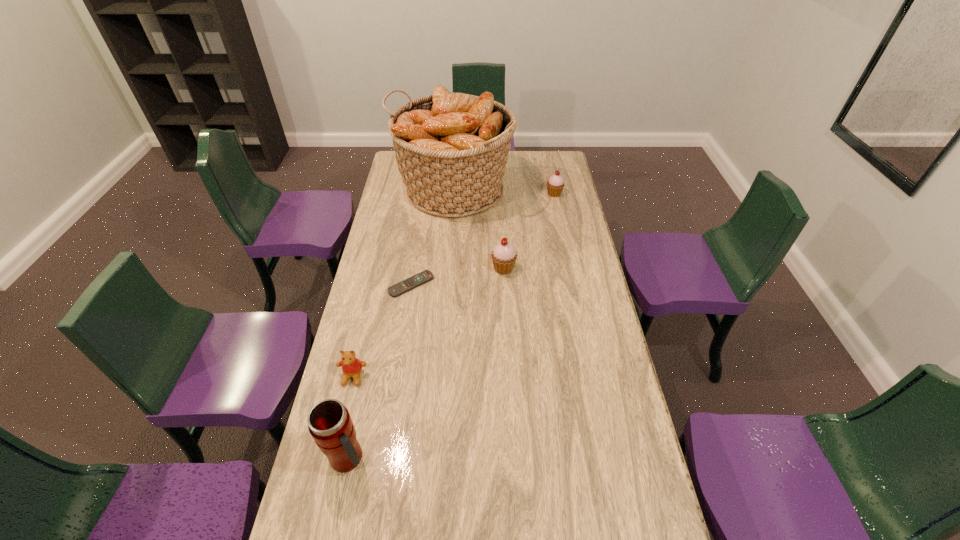
Observe the arrangement of all cupcakes in the image. To keep them evenly spaced, where would you place another cupcake on the left? Please locate a free space. Please provide its 2D coordinates. Your answer should be formatted as a tuple, i.e. [(x, y)], where the tuple contains the x and y coordinates of a point satisfying the conditions above.

[(426, 382)]